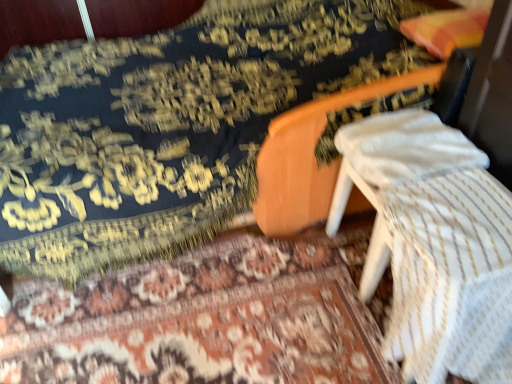
Question: Considering the relative sizes of velvet-like dark blue mattress at center and floral carpet at center in the image provided, is velvet-like dark blue mattress at center smaller than floral carpet at center?

Choices:
 (A) no
 (B) yes

Answer: (A)

Question: Is floral carpet at center at the back of velvet-like dark blue mattress at center?

Choices:
 (A) yes
 (B) no

Answer: (B)

Question: Is velvet-like dark blue mattress at center thinner than floral carpet at center?

Choices:
 (A) yes
 (B) no

Answer: (B)

Question: Is velvet-like dark blue mattress at center with floral carpet at center?

Choices:
 (A) no
 (B) yes

Answer: (A)

Question: From the image's perspective, is velvet-like dark blue mattress at center located above floral carpet at center?

Choices:
 (A) yes
 (B) no

Answer: (A)

Question: Would you say velvet-like dark blue mattress at center is a long distance from floral carpet at center?

Choices:
 (A) no
 (B) yes

Answer: (A)

Question: Is white cotton pillow at center taller than velvet-like dark blue mattress at center?

Choices:
 (A) no
 (B) yes

Answer: (A)

Question: Is white cotton pillow at center not near velvet-like dark blue mattress at center?

Choices:
 (A) yes
 (B) no

Answer: (B)

Question: Is the depth of white cotton pillow at center greater than that of velvet-like dark blue mattress at center?

Choices:
 (A) no
 (B) yes

Answer: (B)

Question: Is white cotton pillow at center at the right side of velvet-like dark blue mattress at center?

Choices:
 (A) no
 (B) yes

Answer: (B)

Question: Is white cotton pillow at center bigger than velvet-like dark blue mattress at center?

Choices:
 (A) yes
 (B) no

Answer: (B)

Question: From the image's perspective, is white cotton pillow at center beneath velvet-like dark blue mattress at center?

Choices:
 (A) yes
 (B) no

Answer: (A)

Question: Is white cotton pillow at center at the left side of floral carpet at center?

Choices:
 (A) yes
 (B) no

Answer: (B)